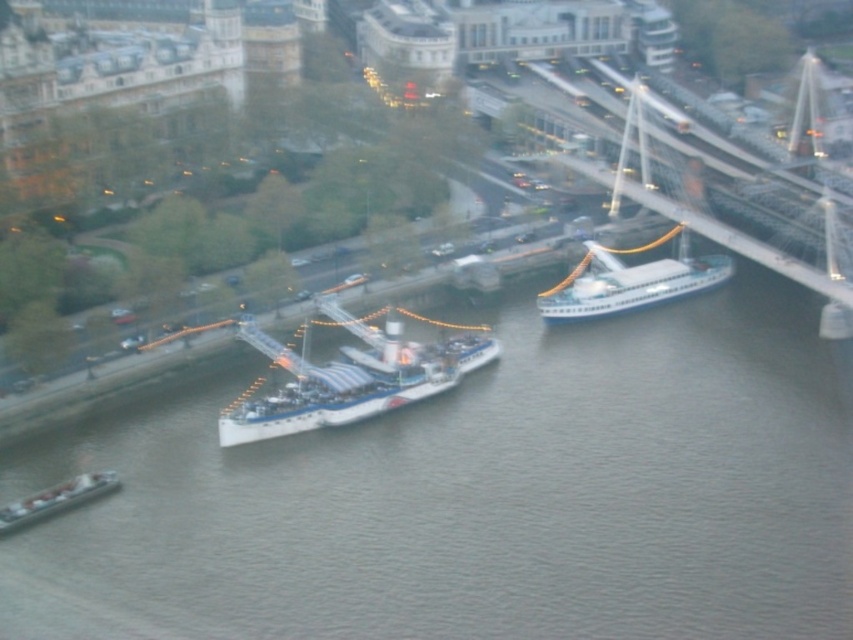
Question: Is gray water at center above metallic gray barge at lower left?

Choices:
 (A) no
 (B) yes

Answer: (B)

Question: Is white glossy ship at center to the left of white glossy ship at right from the viewer's perspective?

Choices:
 (A) yes
 (B) no

Answer: (A)

Question: Is the position of gray water at center less distant than that of metallic gray barge at lower left?

Choices:
 (A) no
 (B) yes

Answer: (B)

Question: Among these points, which one is farthest from the camera?

Choices:
 (A) (677, 291)
 (B) (321, 387)
 (C) (764, 412)
 (D) (68, 490)

Answer: (A)

Question: Among these points, which one is nearest to the camera?

Choices:
 (A) (471, 364)
 (B) (732, 474)

Answer: (B)

Question: Estimate the real-world distances between objects in this image. Which object is closer to the white glossy ship at center?

Choices:
 (A) white glossy ship at right
 (B) metallic gray barge at lower left

Answer: (B)